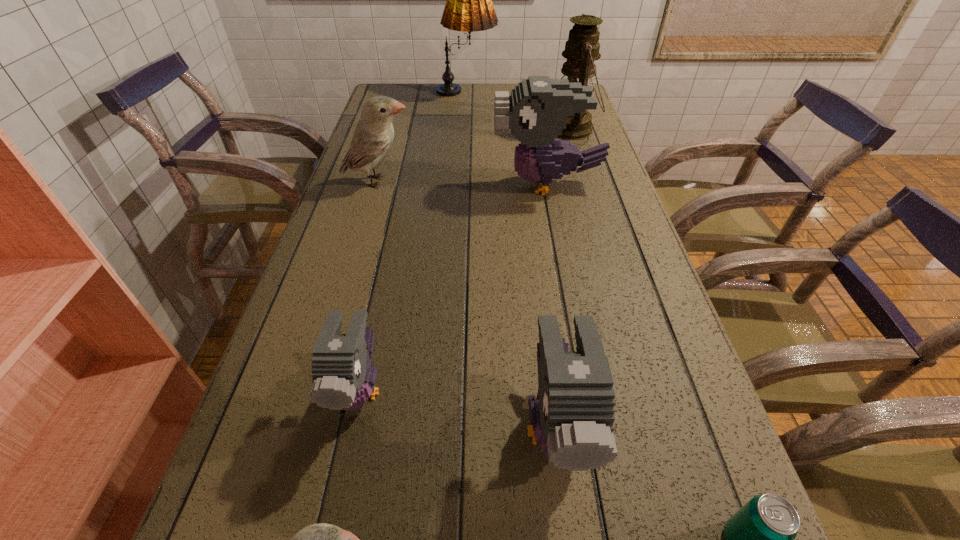
Find the location of a particular element. the farthest object is located at coordinates (469, 8).

Identify the location of green oil lamp. This screenshot has width=960, height=540. (582, 48).

This screenshot has width=960, height=540. I want to click on the seventh nearest object, so [x=582, y=48].

Find the location of a particular element. The width and height of the screenshot is (960, 540). the biggest gray bird is located at coordinates (536, 112).

You are a GUI agent. You are given a task and a screenshot of the screen. Output one action in this format:
    pyautogui.click(x=<x>, y=<y>)
    Task: Click on the farther white bird
    This screenshot has height=540, width=960.
    Given the screenshot: What is the action you would take?
    pyautogui.click(x=373, y=137)

You are a GUI agent. You are given a task and a screenshot of the screen. Output one action in this format:
    pyautogui.click(x=<x>, y=<y>)
    Task: Click on the second smallest gray bird
    The height and width of the screenshot is (540, 960).
    Given the screenshot: What is the action you would take?
    coord(572,420)

Image resolution: width=960 pixels, height=540 pixels. In order to click on the leftmost gray bird in this screenshot , I will do (343, 379).

In order to click on free spot located 0.170m on the front-facing side of the lampshade in this screenshot , I will do `click(542, 94)`.

Find the location of a particular element. vacant space positioned 0.360m on the front of the second farthest object is located at coordinates (600, 217).

You are a GUI agent. You are given a task and a screenshot of the screen. Output one action in this format:
    pyautogui.click(x=<x>, y=<y>)
    Task: Click on the vacant space situated 0.400m at the beak of the farthest gray bird
    The width and height of the screenshot is (960, 540).
    Given the screenshot: What is the action you would take?
    point(349,184)